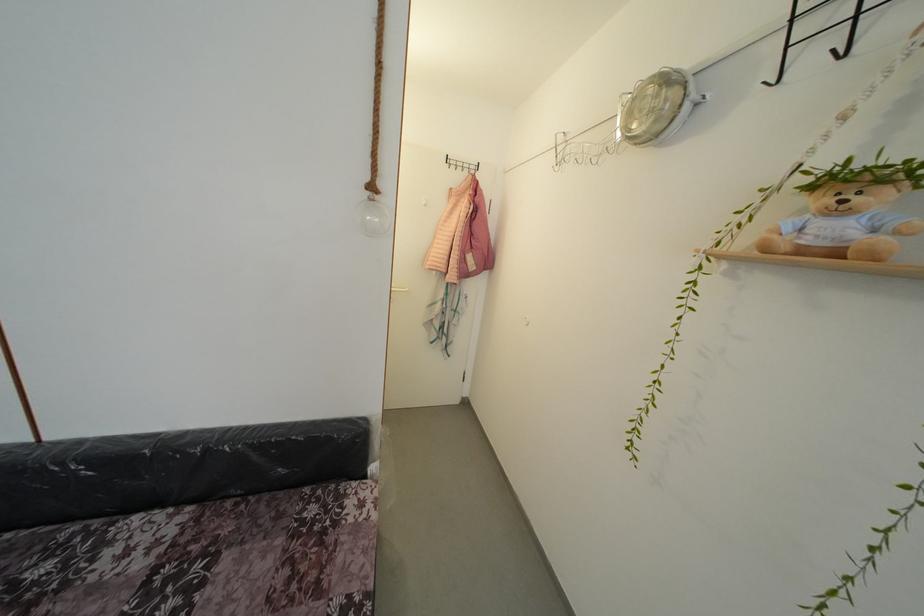
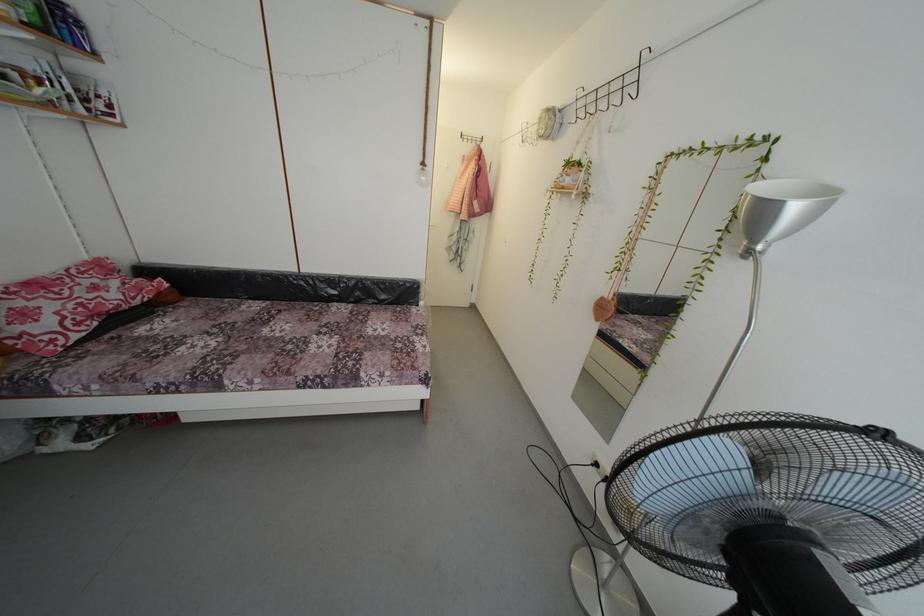
The point at (695, 69) is marked in the first image. Where is the corresponding point in the second image?

(564, 111)